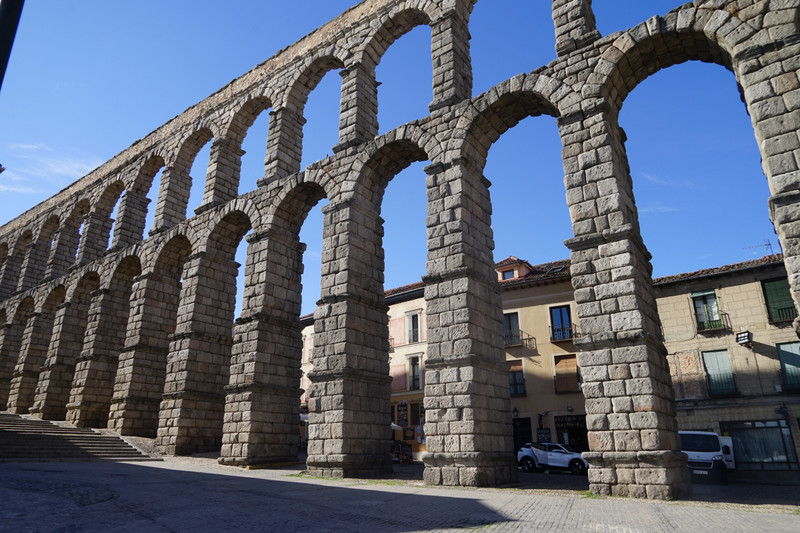
Locate an element on the screen. The image size is (800, 533). window is located at coordinates (706, 310).